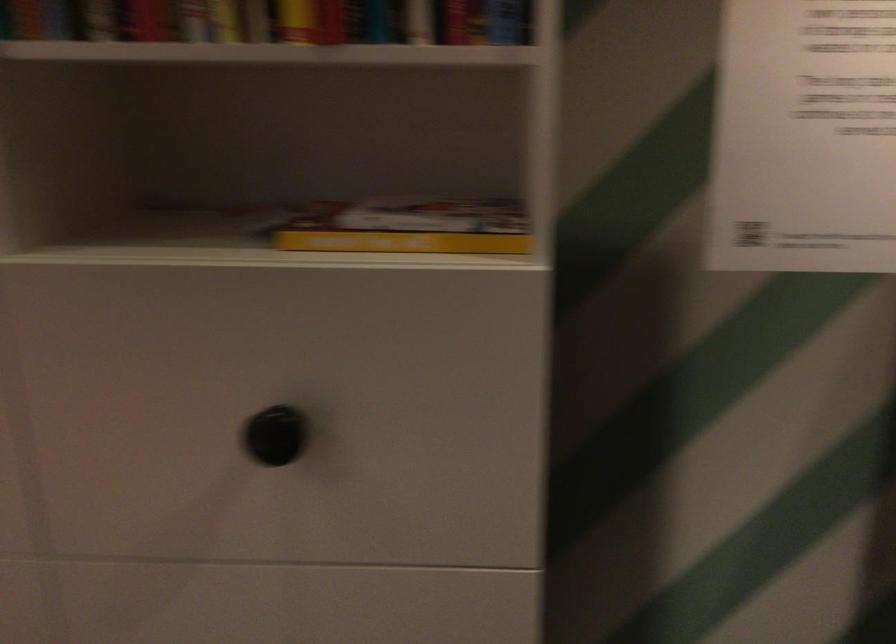
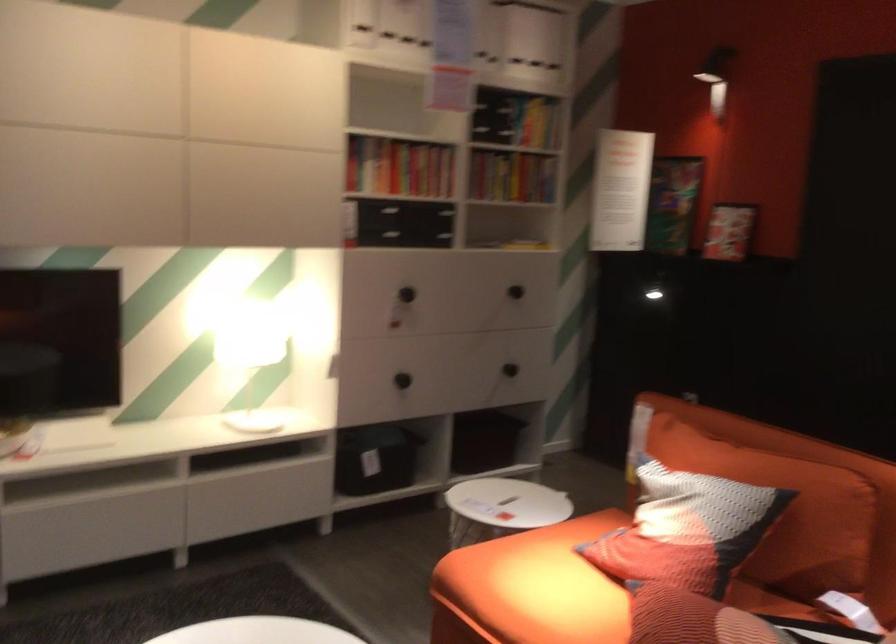
Find the pixel in the second image that matches (323,313) in the first image.

(524, 245)